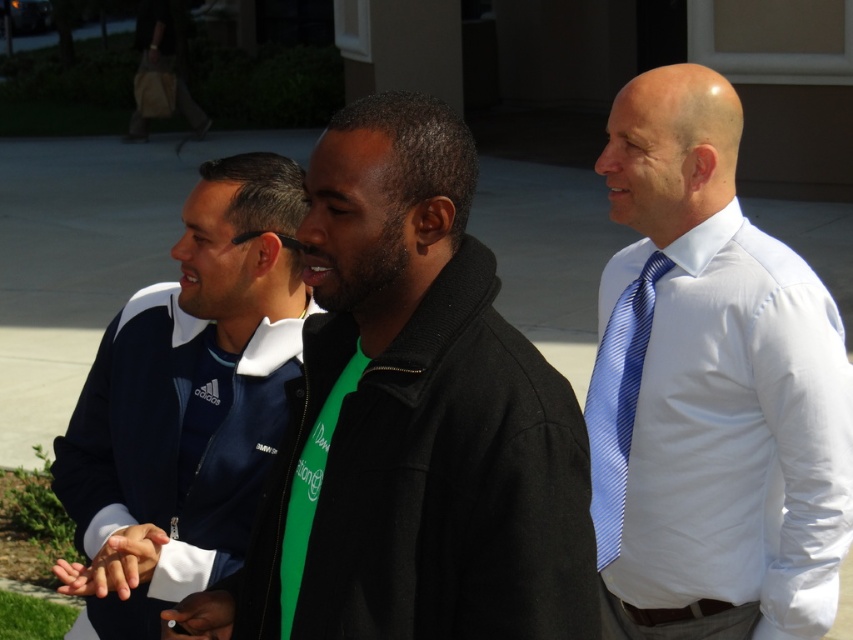
You are a photographer trying to capture a candid shot of the blue striped tie at right and the blue striped tie at center. Which tie is covering part of the other?

The blue striped tie at right is positioned over the blue striped tie at center, so it is covering part of the latter.

Based on the coordinates provided, which object is located at point (412, 420)?

The point (412, 420) marks the location of the black matte jacket at center.